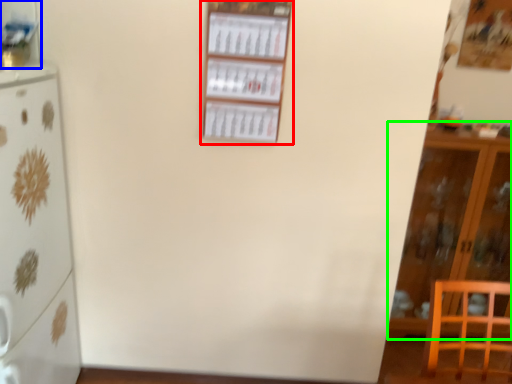
Question: Estimate the real-world distances between objects in this image. Which object is farther from shelf (highlighted by a red box), shelf (highlighted by a blue box) or cabinetry (highlighted by a green box)?

Choices:
 (A) shelf
 (B) cabinetry

Answer: (B)